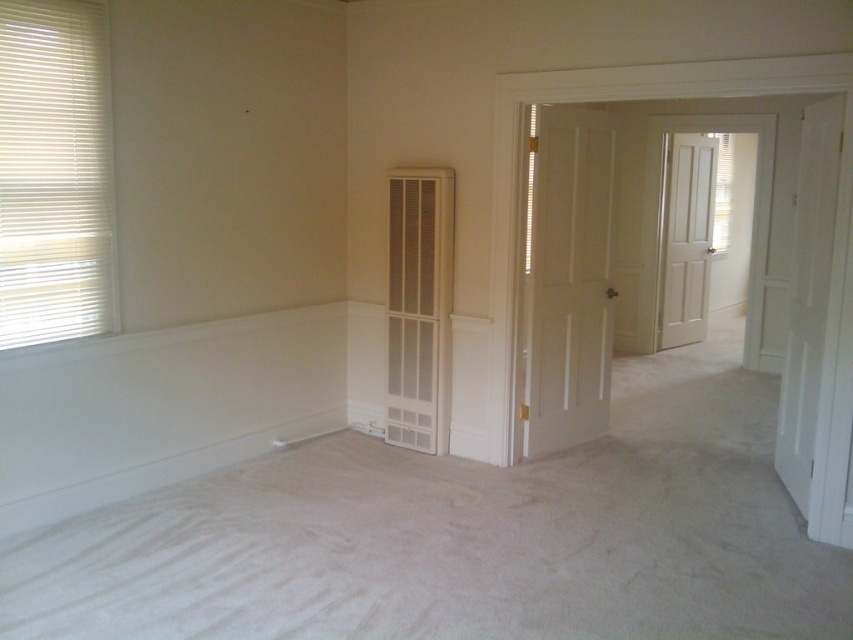
Question: Which point is farther to the camera?

Choices:
 (A) (706, 296)
 (B) (57, 12)
 (C) (576, 428)

Answer: (A)

Question: Is the position of white blinds at left more distant than that of white matte door at center right?

Choices:
 (A) no
 (B) yes

Answer: (A)

Question: Does white blinds at left appear on the left side of white matte door at center?

Choices:
 (A) yes
 (B) no

Answer: (A)

Question: Which point is farther from the camera taking this photo?

Choices:
 (A) (674, 134)
 (B) (28, 42)
 (C) (596, 216)

Answer: (A)

Question: Which of the following is the closest to the observer?

Choices:
 (A) white matte door at center
 (B) white blinds at left
 (C) white matte door at center right

Answer: (B)

Question: Observing the image, what is the correct spatial positioning of white blinds at left in reference to white matte door at center right?

Choices:
 (A) left
 (B) right

Answer: (A)